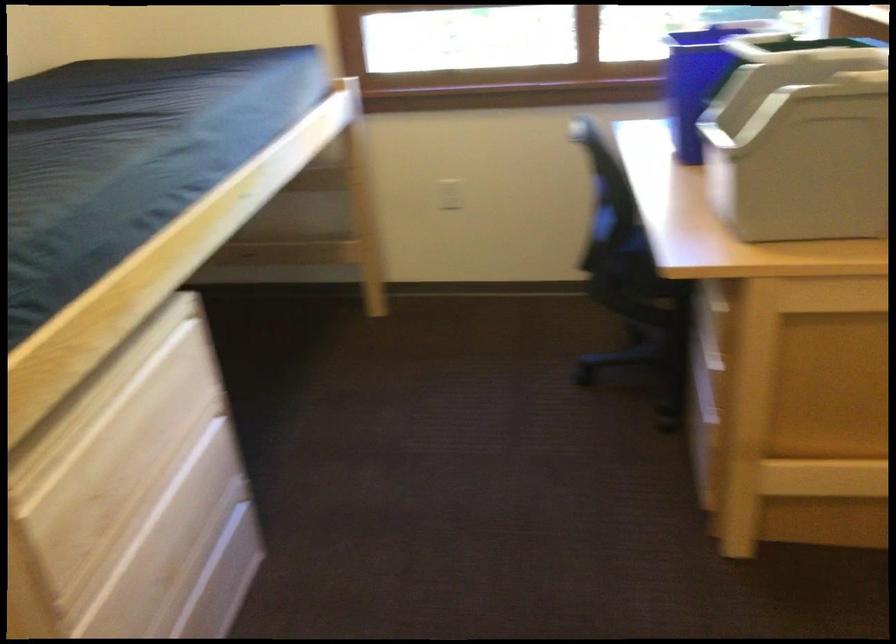
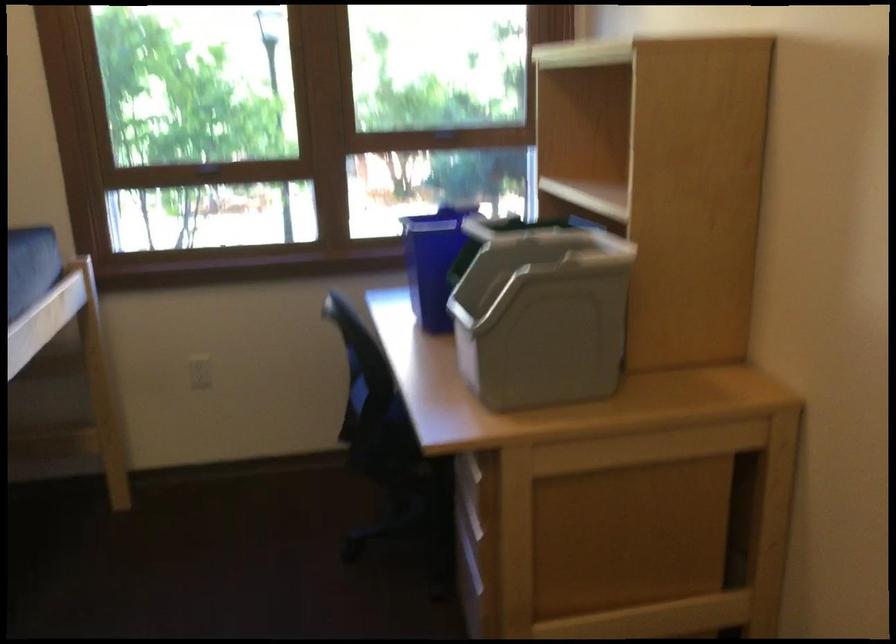
Find the pixel in the second image that matches [698,82] in the first image.

(433, 261)